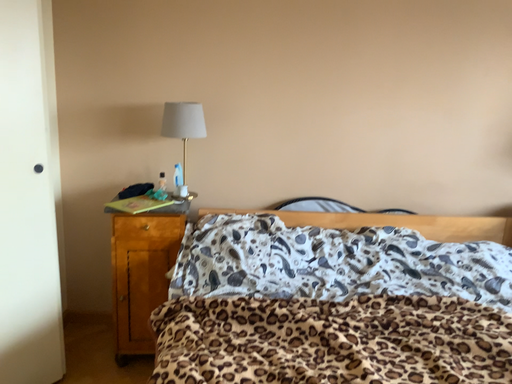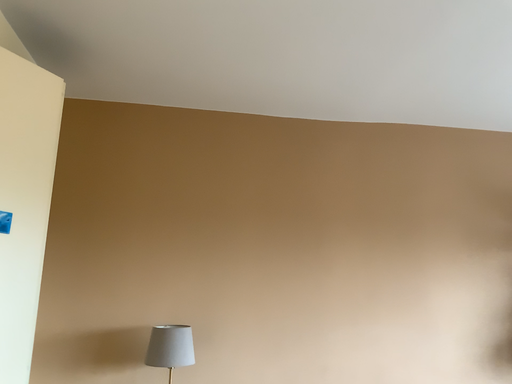
Question: Which way did the camera rotate in the video?

Choices:
 (A) rotated upward
 (B) rotated downward

Answer: (A)